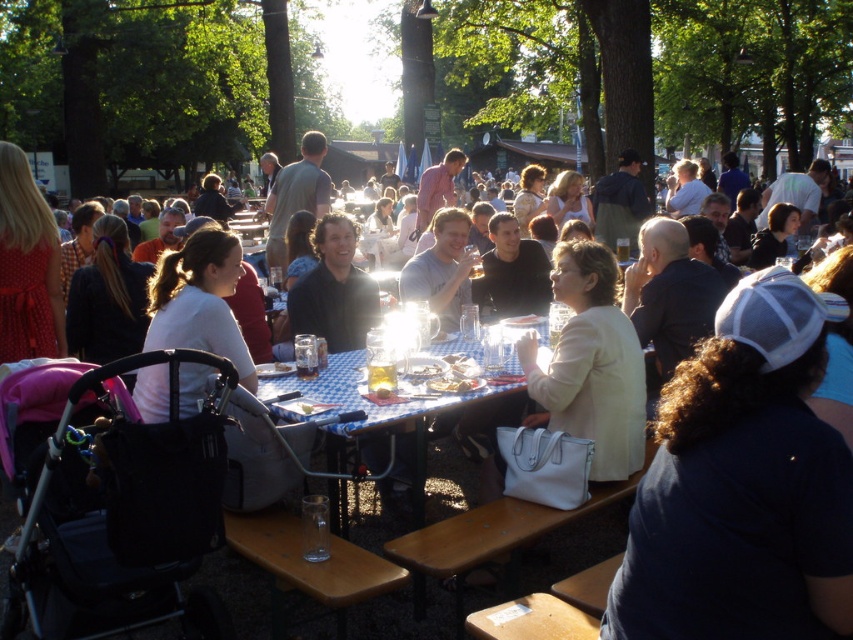
Question: Which of the following is the closest to the observer?

Choices:
 (A) (796, 408)
 (B) (447, 346)

Answer: (A)

Question: Which point is closer to the camera taking this photo?

Choices:
 (A) (755, 456)
 (B) (340, 435)

Answer: (A)

Question: Is dark blue t-shirt at center to the left of blue checkered tablecloth at center from the viewer's perspective?

Choices:
 (A) no
 (B) yes

Answer: (A)

Question: Which point is farther from the camera taking this photo?

Choices:
 (A) (767, 413)
 (B) (397, 451)

Answer: (B)

Question: Can you confirm if dark blue t-shirt at center is bigger than blue checkered tablecloth at center?

Choices:
 (A) no
 (B) yes

Answer: (A)

Question: Where is dark blue t-shirt at center located in relation to blue checkered tablecloth at center in the image?

Choices:
 (A) left
 (B) right

Answer: (B)